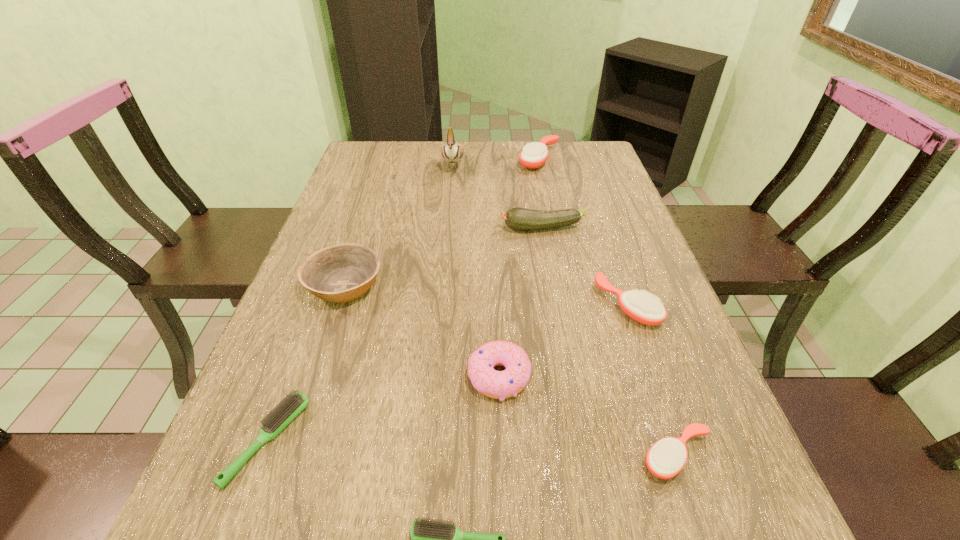
Where is `object that is the eighth nearest to the farthest orange hairbrush`? This screenshot has height=540, width=960. object that is the eighth nearest to the farthest orange hairbrush is located at coordinates (431, 539).

Image resolution: width=960 pixels, height=540 pixels. Find the location of `object that stands as the seventh closest to the bird`. object that stands as the seventh closest to the bird is located at coordinates (666, 458).

You are a GUI agent. You are given a task and a screenshot of the screen. Output one action in this format:
    pyautogui.click(x=<x>, y=<y>)
    Task: Click on the fourth closest hairbrush to the tallest hairbrush
    The width and height of the screenshot is (960, 540).
    Given the screenshot: What is the action you would take?
    click(431, 539)

What are the coordinates of `hairbrush object that ranks as the closest to the tallest hairbrush` in the screenshot? It's located at (641, 306).

Find the location of a particular element. orange hairbrush that can be found as the second closest to the second smallest orange hairbrush is located at coordinates (534, 155).

Locate an element on the screen. The width and height of the screenshot is (960, 540). the closest orange hairbrush relative to the nearest orange hairbrush is located at coordinates (641, 306).

The image size is (960, 540). I want to click on free spot that satisfies the following two spatial constraints: 1. on the front side of the pink doughnut; 2. on the left side of the bowl, so click(x=315, y=376).

Locate an element on the screen. vacant space that satisfies the following two spatial constraints: 1. at the face of the tallest object; 2. on the left side of the smallest orange hairbrush is located at coordinates (426, 456).

Image resolution: width=960 pixels, height=540 pixels. I want to click on vacant area in the image that satisfies the following two spatial constraints: 1. on the front side of the bigger light hairbrush; 2. on the right side of the nearest orange hairbrush, so click(261, 456).